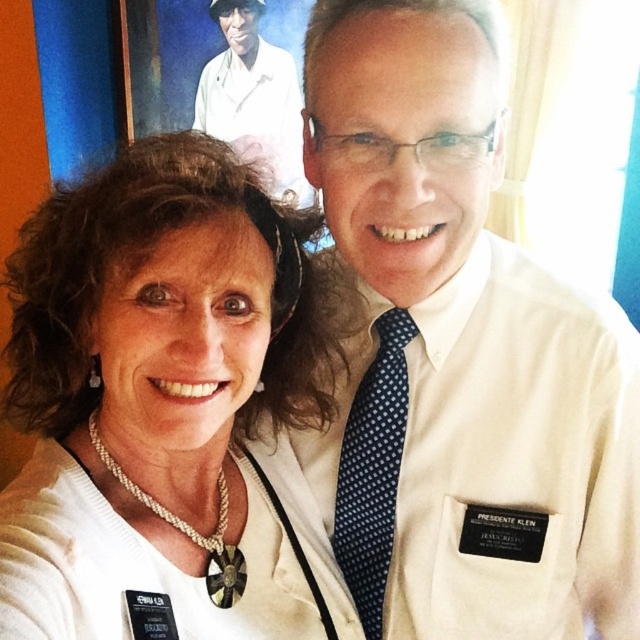
Question: Which point is closer to the camera?

Choices:
 (A) blue dotted tie at center
 (B) pearl necklace at center

Answer: (B)

Question: Which of the following is the closest to the observer?

Choices:
 (A) (300, 141)
 (B) (45, 611)
 (C) (348, 451)

Answer: (B)

Question: Considering the relative positions of pearl necklace at center and blue dotted tie at center in the image provided, where is pearl necklace at center located with respect to blue dotted tie at center?

Choices:
 (A) right
 (B) left

Answer: (B)

Question: Can you confirm if pearl necklace at center is thinner than white smooth shirt at upper center?

Choices:
 (A) yes
 (B) no

Answer: (B)

Question: Is blue dotted tie at center smaller than white smooth shirt at upper center?

Choices:
 (A) yes
 (B) no

Answer: (A)

Question: Which object is farther from the camera taking this photo?

Choices:
 (A) white smooth shirt at upper center
 (B) pearl necklace at center
 (C) blue dotted tie at center

Answer: (A)